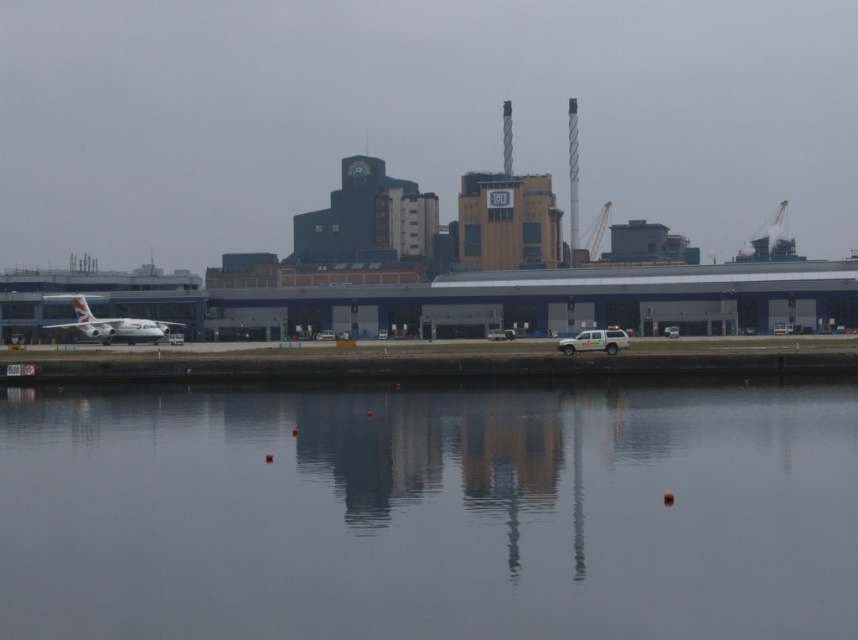
You are a photographer trying to capture the silver metallic airplane at left and the transparent glass water at center in the same frame. Based on their heights, which object should you focus on first to ensure both are in the shot?

The transparent glass water at center is shorter than the silver metallic airplane at left, so you should focus on the silver metallic airplane at left first to ensure both are in the shot.

You are standing at the airport and see the transparent glass water at center and the silver metallic airplane at left. Which object is positioned to the right of the other?

The transparent glass water at center is positioned to the right of the silver metallic airplane at left.